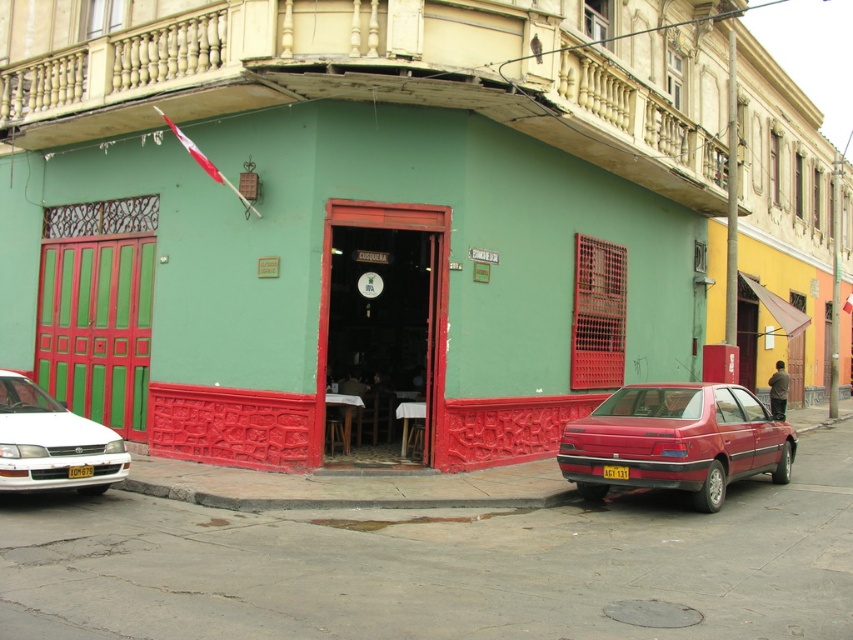
Question: Which point is closer to the camera?

Choices:
 (A) (79, 468)
 (B) (610, 472)
 (C) (558, 493)

Answer: (A)

Question: Considering the relative positions of glossy red car at lower right and yellow matte license plate at center in the image provided, where is glossy red car at lower right located with respect to yellow matte license plate at center?

Choices:
 (A) right
 (B) left

Answer: (A)

Question: Does white glossy sedan at left lie behind yellow metallic license plate at center?

Choices:
 (A) yes
 (B) no

Answer: (B)

Question: Which point is farther from the camera taking this photo?

Choices:
 (A) (619, 477)
 (B) (241, 500)
 (C) (78, 470)

Answer: (A)

Question: Which point is farther to the camera?

Choices:
 (A) gray concrete curb at lower center
 (B) yellow matte license plate at center

Answer: (B)

Question: From the image, what is the correct spatial relationship of white glossy sedan at left in relation to yellow matte license plate at center?

Choices:
 (A) below
 (B) above

Answer: (B)